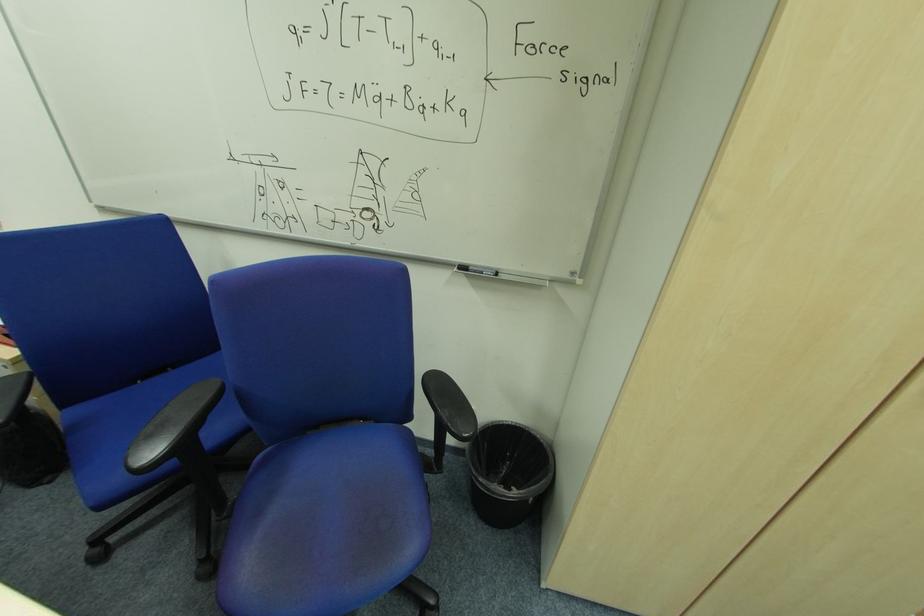
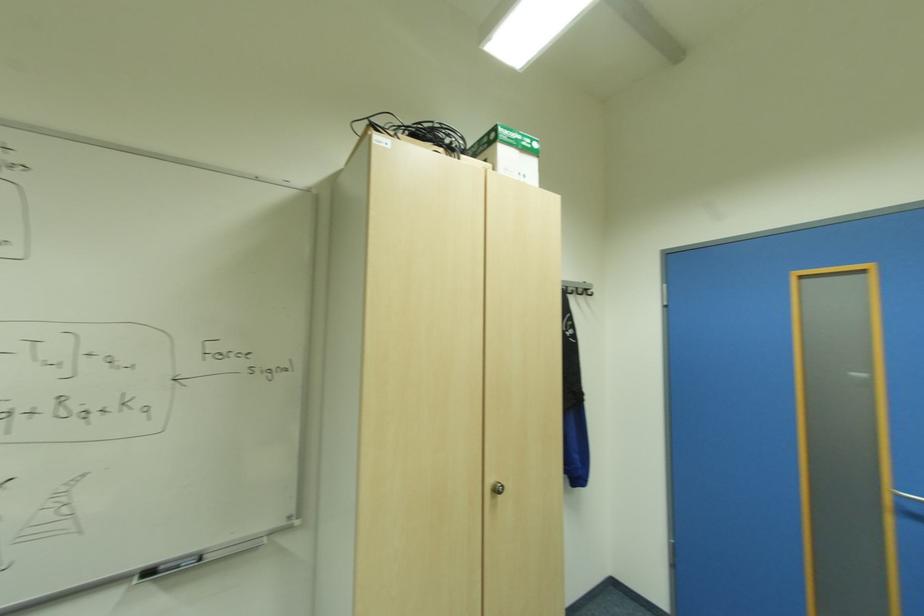
Based on the continuous images, in which direction is the camera rotating?

The camera rotated toward right-up.